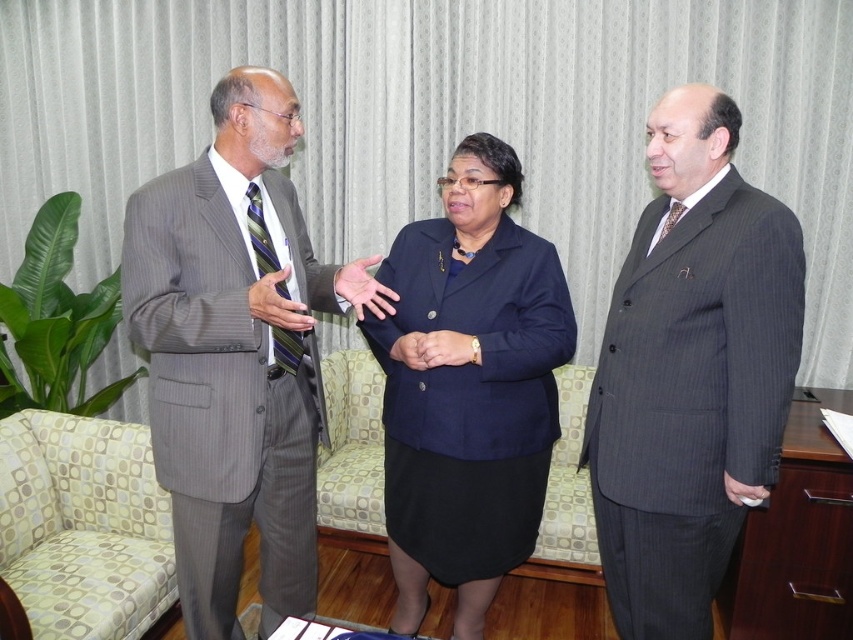
You are a photographer setting up a shoot in the office. You need to place a small microphone between the gray pinstripe suit at left and the navy blue fabric skirt at center. Where should you place it?

The microphone should be placed between the gray pinstripe suit at left and the navy blue fabric skirt at center, closer to the navy blue fabric skirt at center since the gray pinstripe suit at left is positioned on the left side of it.

You are standing in the office and want to take a photo of the point at coordinates (271, 156). Is this point within the camera frame?

The point at coordinates (271, 156) is 5.47 feet away from the camera, so it is within the camera frame.